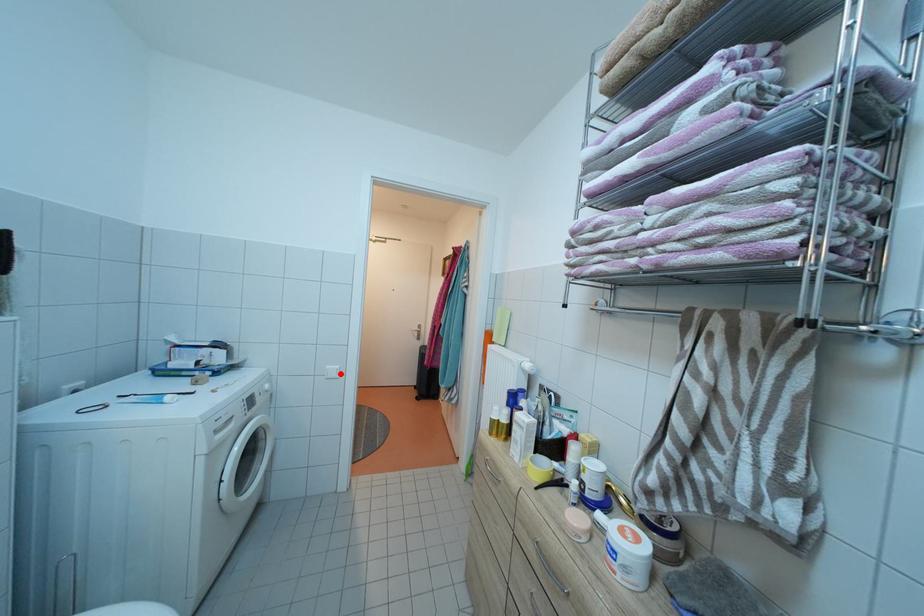
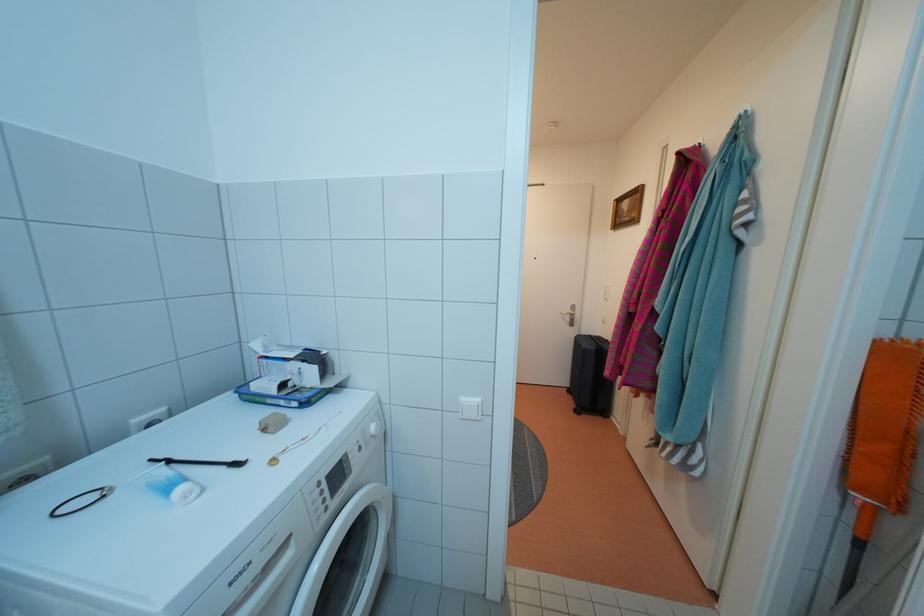
Where in the second image is the point corresponding to the highlighted location from the first image?

(478, 408)